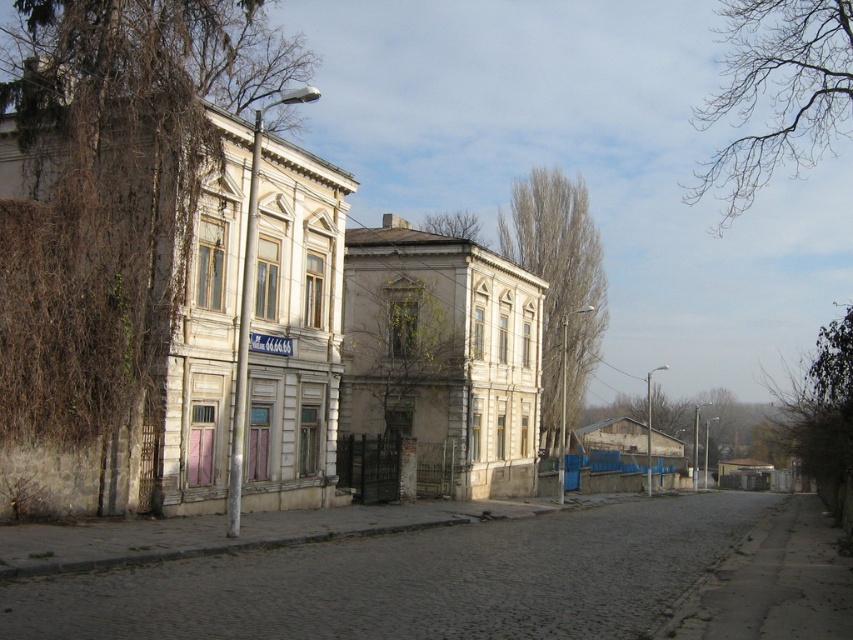
You are a pedestrian walking on the cobblestone street at lower left and looking up. Do you see the bare branches at upper right above you?

Yes, the cobblestone street at lower left is below bare branches at upper right, so when looking up from the cobblestone street at lower left, the bare branches at upper right are visible above.

From the picture: You are a delivery person trying to navigate a narrow cobblestone street at lower left. There are bare branches at upper right that might block your path. Based on the scene description, can you pass through the area without hitting the branches?

The cobblestone street at lower left is shorter than the bare branches at upper right, so the branches are longer and might extend further down. This could potentially block your path, so you should proceed with caution to avoid hitting the branches.